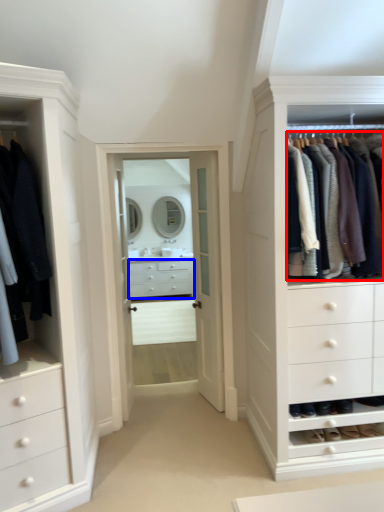
Question: Which of the following is the closest to the observer, clothing (highlighted by a red box) or drawer (highlighted by a blue box)?

Choices:
 (A) clothing
 (B) drawer

Answer: (A)